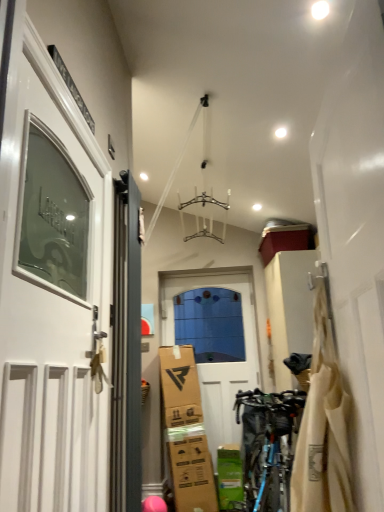
Question: Is blue metallic bicycle at lower right smaller than white glossy door at left, the 1th door positioned from the left?

Choices:
 (A) no
 (B) yes

Answer: (B)

Question: Considering the relative sizes of blue metallic bicycle at lower right and white glossy door at left, the 3th door positioned from the right, in the image provided, is blue metallic bicycle at lower right bigger than white glossy door at left, the 3th door positioned from the right,?

Choices:
 (A) no
 (B) yes

Answer: (A)

Question: Is blue metallic bicycle at lower right far from white glossy door at left, marked as the 3th door in a back-to-front arrangement?

Choices:
 (A) yes
 (B) no

Answer: (A)

Question: Can you confirm if blue metallic bicycle at lower right is positioned to the right of white glossy door at left, the 1th door positioned from the left?

Choices:
 (A) yes
 (B) no

Answer: (A)

Question: Can we say blue metallic bicycle at lower right lies outside white glossy door at left, the 3th door positioned from the right?

Choices:
 (A) yes
 (B) no

Answer: (A)

Question: From the image's perspective, does blue metallic bicycle at lower right appear higher than white glossy door at left, the first door viewed from the front?

Choices:
 (A) no
 (B) yes

Answer: (A)

Question: Considering the relative sizes of blue metallic bicycle at lower right and white matte door at center, the third door viewed from the front, in the image provided, is blue metallic bicycle at lower right wider than white matte door at center, the third door viewed from the front,?

Choices:
 (A) no
 (B) yes

Answer: (B)

Question: Is blue metallic bicycle at lower right outside of white matte door at center, the first door positioned from the back?

Choices:
 (A) yes
 (B) no

Answer: (A)

Question: Can you confirm if blue metallic bicycle at lower right is taller than white matte door at center, placed as the third door when sorted from left to right?

Choices:
 (A) yes
 (B) no

Answer: (B)

Question: Is blue metallic bicycle at lower right to the left of white matte door at center, the first door positioned from the back, from the viewer's perspective?

Choices:
 (A) no
 (B) yes

Answer: (A)

Question: From the image's perspective, is blue metallic bicycle at lower right located beneath white matte door at center, the first door positioned from the back?

Choices:
 (A) yes
 (B) no

Answer: (A)

Question: Is blue metallic bicycle at lower right facing towards white matte door at center, the third door viewed from the front?

Choices:
 (A) yes
 (B) no

Answer: (B)

Question: From a real-world perspective, is white glossy door at left, the first door viewed from the front, beneath matte gray door at left, which is counted as the second door, starting from the right?

Choices:
 (A) no
 (B) yes

Answer: (B)